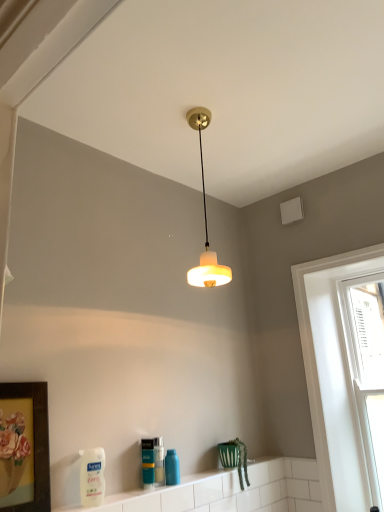
Question: Should I look upward or downward to see white matte bottle at lower left, which appears as the first cleaning product when viewed from the front?

Choices:
 (A) up
 (B) down

Answer: (B)

Question: Is white glossy tile at lower center at the back of translucent plastic bottle at lower center?

Choices:
 (A) yes
 (B) no

Answer: (B)

Question: Could you tell me if translucent plastic bottle at lower center is turned towards white glossy tile at lower center?

Choices:
 (A) yes
 (B) no

Answer: (B)

Question: From a real-world perspective, is translucent plastic bottle at lower center positioned over white glossy tile at lower center based on gravity?

Choices:
 (A) yes
 (B) no

Answer: (A)

Question: Considering the relative sizes of translucent plastic bottle at lower center and white glossy tile at lower center in the image provided, is translucent plastic bottle at lower center taller than white glossy tile at lower center?

Choices:
 (A) no
 (B) yes

Answer: (B)

Question: Is translucent plastic bottle at lower center next to white glossy tile at lower center and touching it?

Choices:
 (A) no
 (B) yes

Answer: (A)

Question: From the image's perspective, does translucent plastic bottle at lower center appear higher than white glossy tile at lower center?

Choices:
 (A) yes
 (B) no

Answer: (A)

Question: Is translucent plastic bottle at lower center bigger than white glossy window at right, the 2th window from the right?

Choices:
 (A) yes
 (B) no

Answer: (B)

Question: From a real-world perspective, is translucent plastic bottle at lower center on top of white glossy window at right, the 1th window from the left?

Choices:
 (A) yes
 (B) no

Answer: (B)

Question: Is translucent plastic bottle at lower center far from white glossy window at right, the 1th window from the left?

Choices:
 (A) yes
 (B) no

Answer: (A)

Question: Considering the relative sizes of translucent plastic bottle at lower center and white glossy window at right, the 1th window from the left, in the image provided, is translucent plastic bottle at lower center smaller than white glossy window at right, the 1th window from the left,?

Choices:
 (A) no
 (B) yes

Answer: (B)

Question: Does translucent plastic bottle at lower center appear on the right side of white glossy window at right, the 2th window from the right?

Choices:
 (A) yes
 (B) no

Answer: (B)

Question: From a real-world perspective, is translucent plastic bottle at lower center under white glossy window at right, the 2th window from the right?

Choices:
 (A) no
 (B) yes

Answer: (B)

Question: Is wooden framed artwork at lower left located within white matte bottle at lower left, which appears as the first cleaning product when viewed from the front?

Choices:
 (A) no
 (B) yes

Answer: (A)